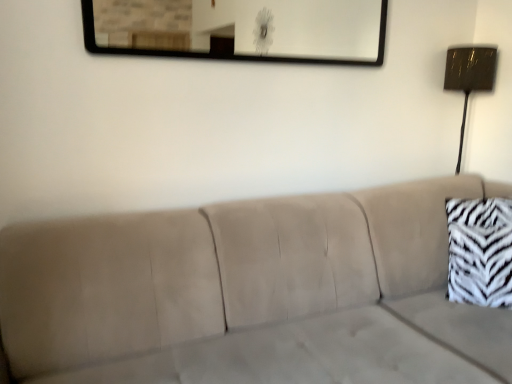
Question: From the image's perspective, relative to metallic rectangular mirror at upper center, is zebra print fabric pillow at right above or below?

Choices:
 (A) above
 (B) below

Answer: (B)

Question: Is zebra print fabric pillow at right to the left or to the right of metallic rectangular mirror at upper center in the image?

Choices:
 (A) left
 (B) right

Answer: (B)

Question: Which object is the farthest from the metallic gold lamp at right?

Choices:
 (A) metallic rectangular mirror at upper center
 (B) beige fabric couch at center
 (C) zebra print fabric pillow at right

Answer: (A)

Question: Which object is the farthest from the zebra print fabric pillow at right?

Choices:
 (A) metallic gold lamp at right
 (B) metallic rectangular mirror at upper center
 (C) beige fabric couch at center

Answer: (B)